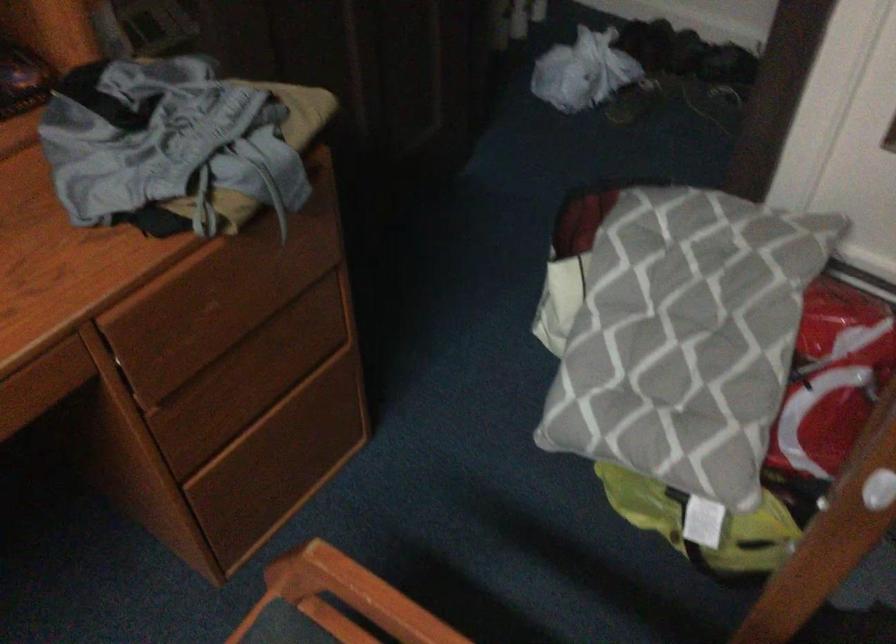
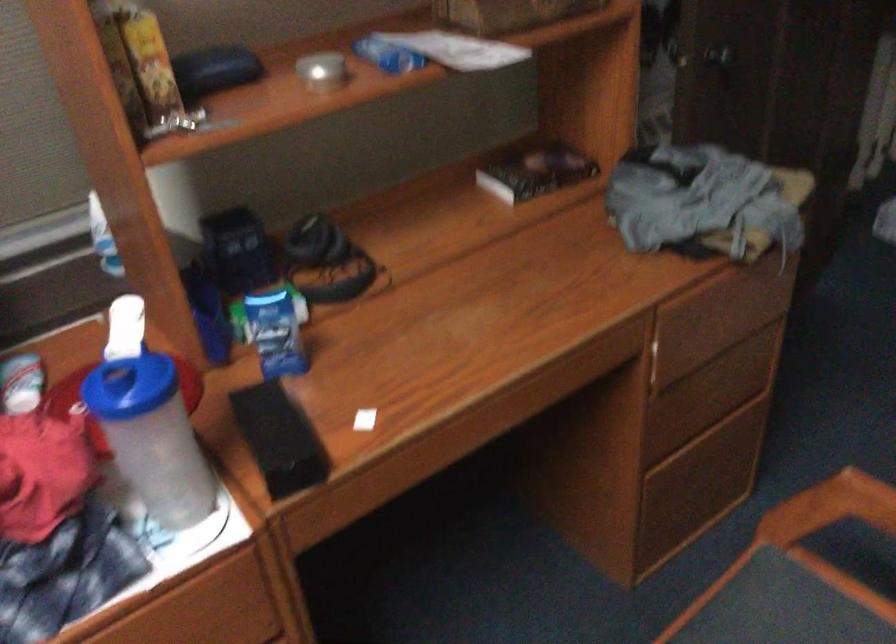
Where in the second image is the point corresponding to point (322, 569) from the first image?

(830, 507)